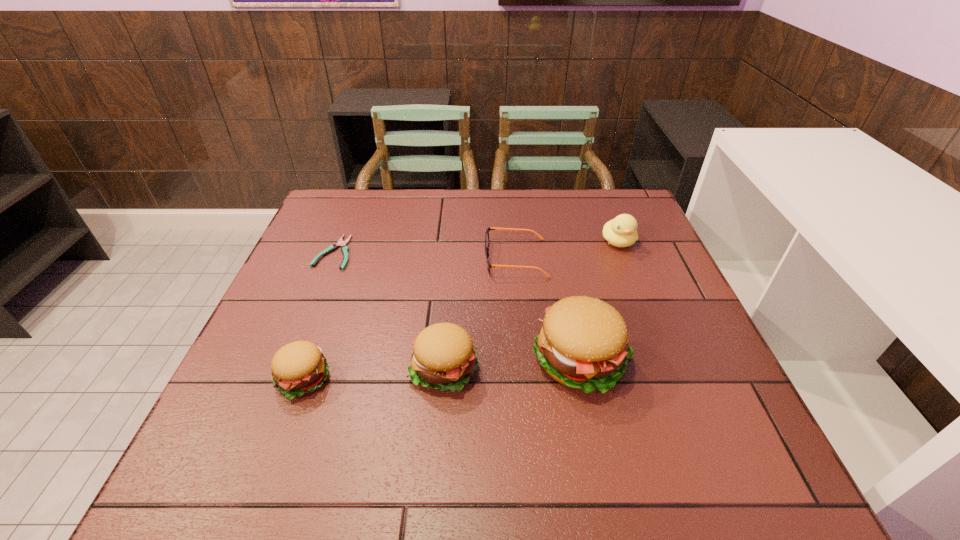
At what (x,y) coordinates should I click in order to perform the action: click on object present at the right edge. Please return your answer as a coordinate pair (x, y). This screenshot has height=540, width=960. Looking at the image, I should click on (621, 231).

This screenshot has width=960, height=540. What are the coordinates of `object at the near left corner` in the screenshot? It's located at (x=298, y=368).

Where is `object that is at the far right corner`? The image size is (960, 540). object that is at the far right corner is located at coordinates (621, 231).

You are a GUI agent. You are given a task and a screenshot of the screen. Output one action in this format:
    pyautogui.click(x=<x>, y=<y>)
    Task: Click on the free space at the far edge
    The image size is (960, 540).
    Given the screenshot: What is the action you would take?
    (588, 217)

In the image, there is a desktop. At what (x,y) coordinates should I click in order to perform the action: click on vacant space at the near edge. Please return your answer as a coordinate pair (x, y). The height and width of the screenshot is (540, 960). Looking at the image, I should click on (394, 410).

Image resolution: width=960 pixels, height=540 pixels. Find the location of `vacant region at the left edge of the desktop`. vacant region at the left edge of the desktop is located at coordinates (281, 323).

Locate an element on the screen. This screenshot has width=960, height=540. free spot at the right edge of the desktop is located at coordinates (626, 276).

The height and width of the screenshot is (540, 960). In order to click on vacant space at the far left corner of the desktop in this screenshot , I will do `click(330, 190)`.

In the image, there is a desktop. At what (x,y) coordinates should I click in order to perform the action: click on vacant space at the near left corner. Please return your answer as a coordinate pair (x, y). Looking at the image, I should click on (266, 400).

In the image, there is a desktop. Where is `vacant space at the far right corner`? vacant space at the far right corner is located at coordinates (601, 199).